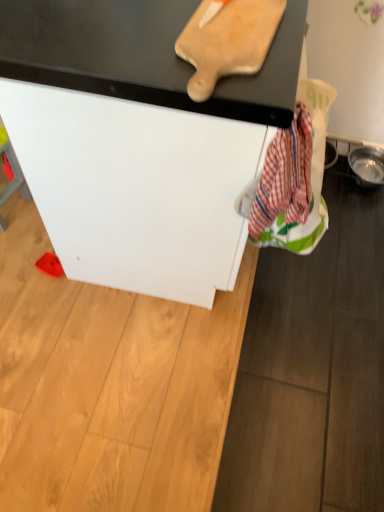
Question: From a real-world perspective, is wooden cutting board at upper center above or below white matte cabinet at center?

Choices:
 (A) above
 (B) below

Answer: (A)

Question: Is point (218, 26) closer or farther from the camera than point (284, 19)?

Choices:
 (A) closer
 (B) farther

Answer: (A)

Question: Which object is the farthest from the wooden cutting board at upper center?

Choices:
 (A) white matte cabinet at center
 (B) red plaid fabric at lower right

Answer: (B)

Question: Considering the real-world distances, which object is farthest from the red plaid fabric at lower right?

Choices:
 (A) wooden cutting board at upper center
 (B) white matte cabinet at center

Answer: (A)